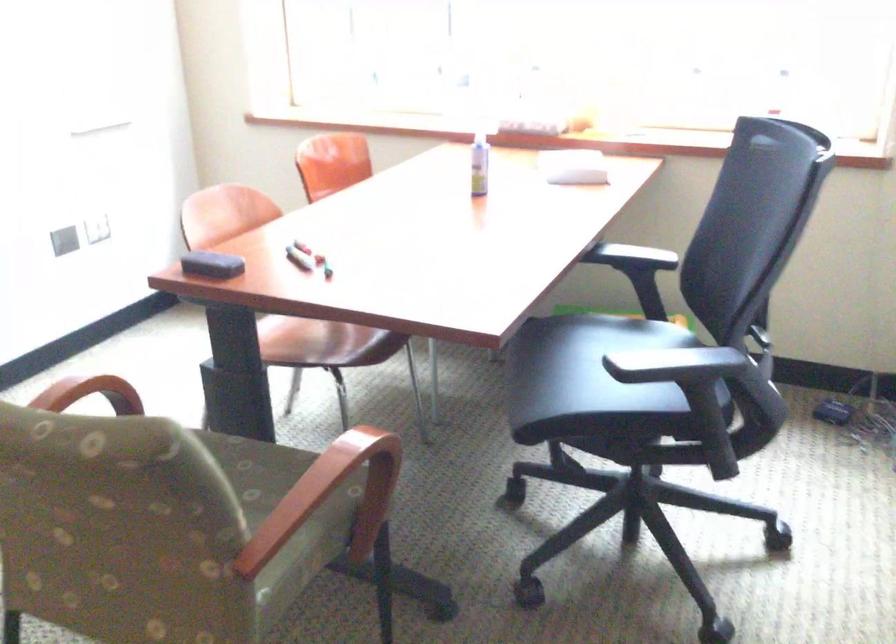
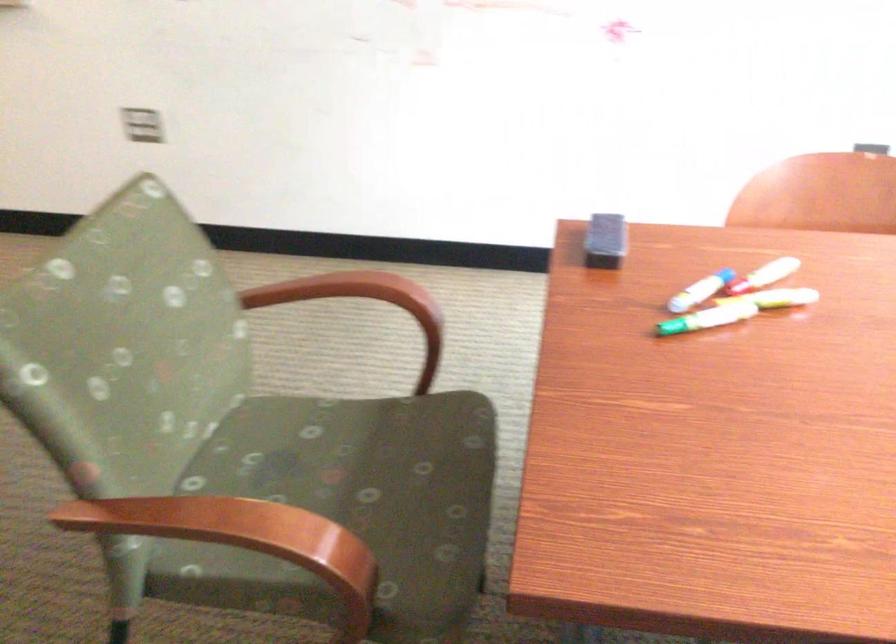
Question: I am providing you with two images of the same scene from different viewpoints. Please identify which objects are invisible in image2.

Choices:
 (A) chair sitting surface
 (B) dry erase marker
 (C) whiteboard eraser
 (D) none of these

Answer: (D)